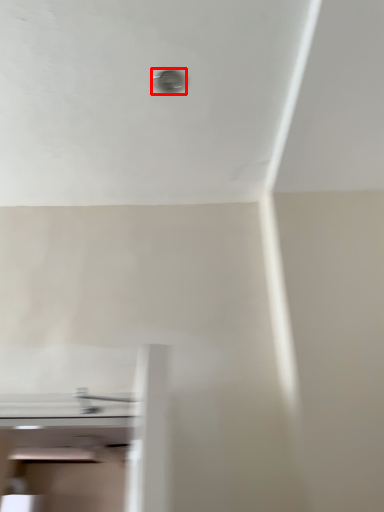
Question: In this image, where is hole (annotated by the red box) located relative to tap?

Choices:
 (A) left
 (B) right

Answer: (B)